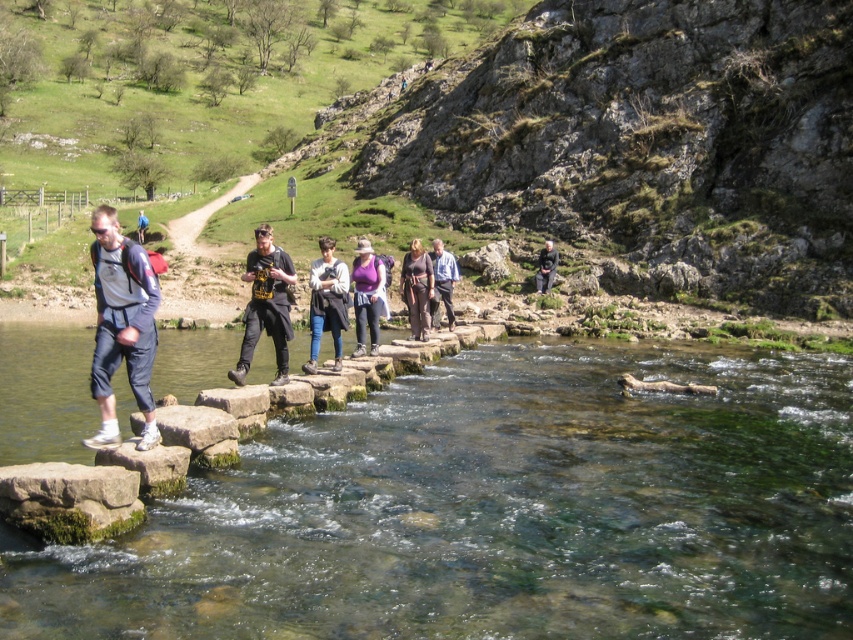
Question: Which object appears closest to the camera in this image?

Choices:
 (A) matte gray backpack at left
 (B) brown fabric pants at center
 (C) dark gray fabric jacket at center
 (D) clear stone stepping stones at center

Answer: (D)

Question: Can you confirm if matte gray shirt at left is wider than brown fabric pants at center?

Choices:
 (A) no
 (B) yes

Answer: (B)

Question: Which point is closer to the camera taking this photo?

Choices:
 (A) (415, 326)
 (B) (434, 285)

Answer: (A)

Question: Where is purple fabric at center located in relation to matte gray backpack at left in the image?

Choices:
 (A) below
 (B) above

Answer: (A)

Question: Which of the following is the closest to the observer?

Choices:
 (A) matte gray shirt at left
 (B) dark gray fabric jacket at center
 (C) light blue shirt at center
 (D) brown fabric pants at center

Answer: (A)

Question: From the image, what is the correct spatial relationship of matte gray shirt at left in relation to denim pants at center?

Choices:
 (A) right
 (B) left

Answer: (B)